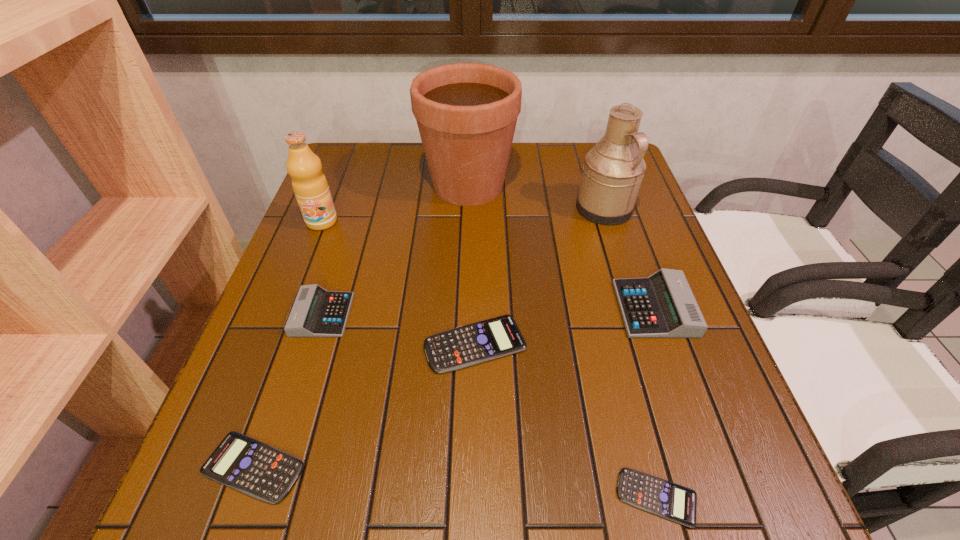
Find the location of a particular element. the leftmost blue calculator is located at coordinates (259, 470).

Find the location of `the smallest blue calculator`. the smallest blue calculator is located at coordinates (663, 498).

The height and width of the screenshot is (540, 960). In order to click on the shortest calculator in this screenshot , I will do `click(663, 498)`.

At what (x,y) coordinates should I click in order to perform the action: click on vacant space located 0.330m on the right of the flowerpot. Please return your answer as a coordinate pair (x, y). The image size is (960, 540). Looking at the image, I should click on (631, 185).

Image resolution: width=960 pixels, height=540 pixels. Identify the location of vacant area situated 0.350m on the front of the pitcher. (645, 340).

This screenshot has width=960, height=540. I want to click on vacant point located 0.380m on the front label of the fruit juice, so click(x=268, y=359).

Identify the location of vacant space located 0.120m on the front of the right gray calculator. The image size is (960, 540). (684, 392).

You are a GUI agent. You are given a task and a screenshot of the screen. Output one action in this format:
    pyautogui.click(x=<x>, y=<y>)
    Task: Click on the vacant space located on the right of the smaller gray calculator
    Image resolution: width=960 pixels, height=540 pixels.
    Given the screenshot: What is the action you would take?
    pyautogui.click(x=440, y=315)

Find the location of a particular element. This screenshot has width=960, height=540. vacant space located 0.290m on the back of the farthest blue calculator is located at coordinates (476, 227).

Where is `free space located on the right of the leftmost blue calculator`? free space located on the right of the leftmost blue calculator is located at coordinates (534, 467).